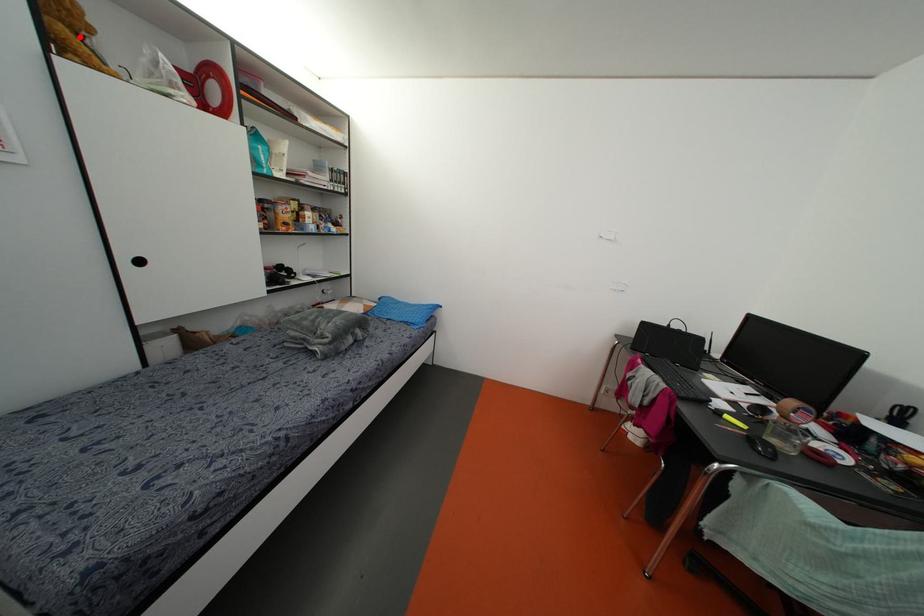
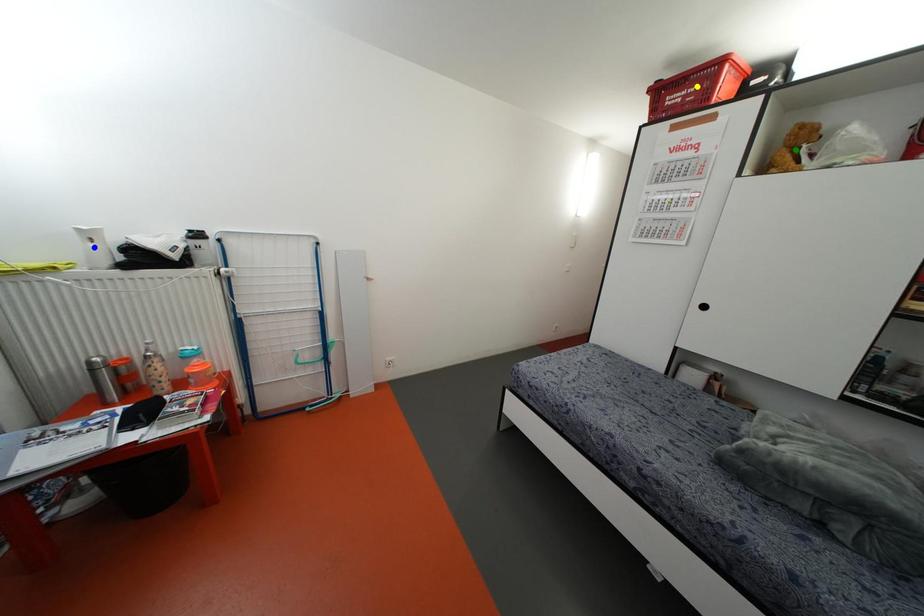
Question: I am providing you with two images of the same scene from different viewpoints. A red point is marked on the first image. You are given multiple points on the second image. Which spot in image 2 lines up with the point in image 1?

Choices:
 (A) blue point
 (B) green point
 (C) yellow point

Answer: (B)